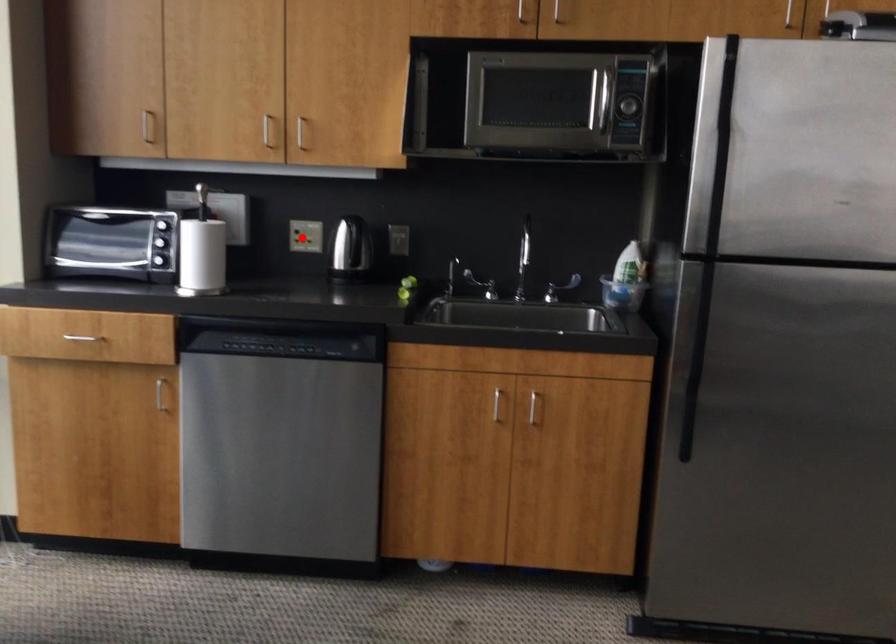
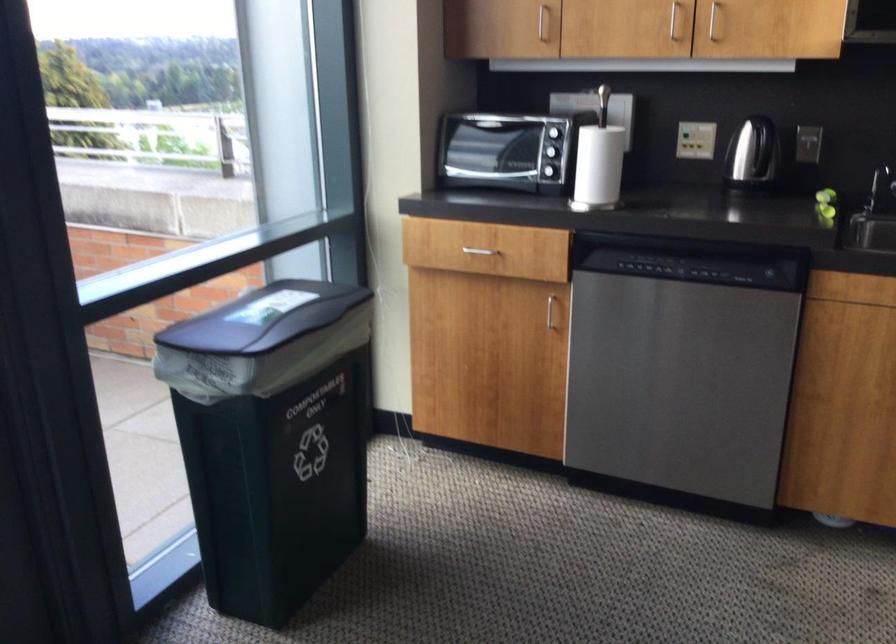
Find the pixel in the second image that matches the highlighted location in the first image.

(695, 140)